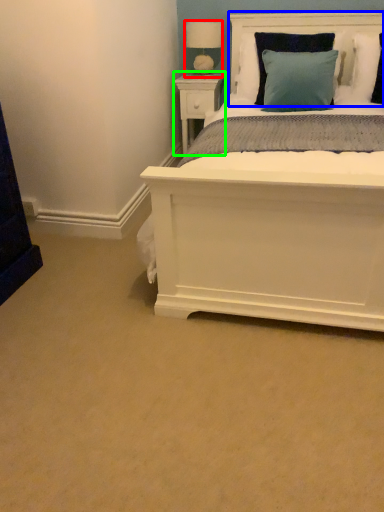
Question: Which is farther away from table lamp (highlighted by a red box)? headboard (highlighted by a blue box) or nightstand (highlighted by a green box)?

Choices:
 (A) headboard
 (B) nightstand

Answer: (A)